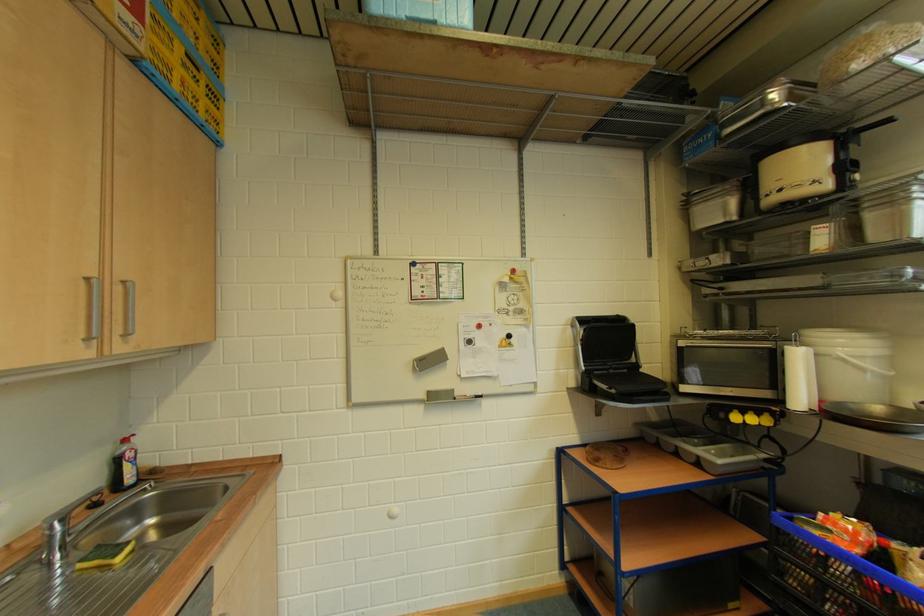
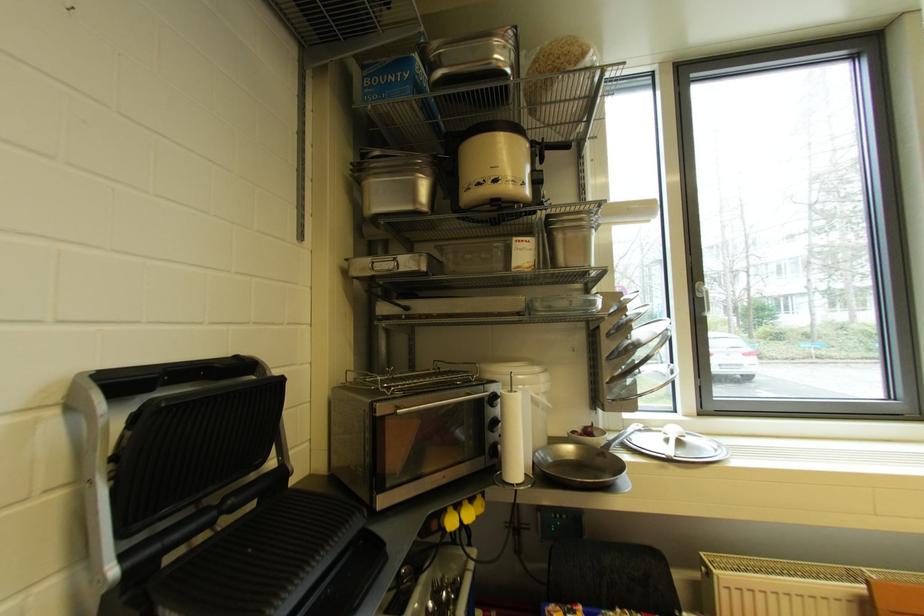
Find the pixel in the second image that matches [758,416] in the first image.

(472, 505)